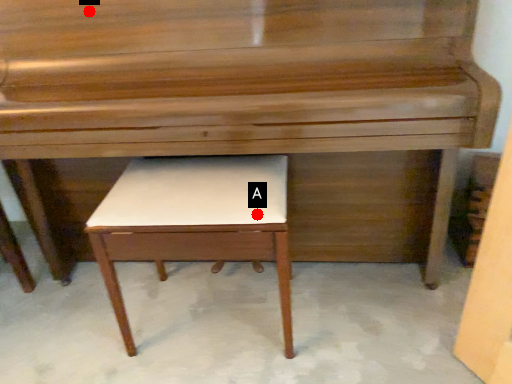
Question: Two points are circled on the image, labeled by A and B beside each circle. Which point appears farthest from the camera in this image?

Choices:
 (A) A is further
 (B) B is further

Answer: (B)